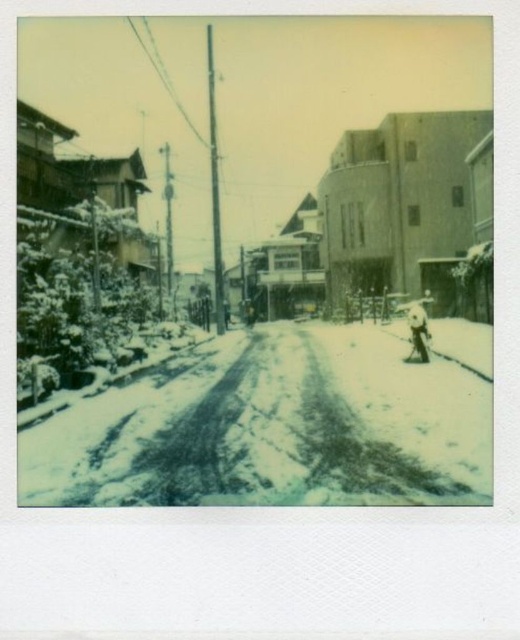
You are a delivery person trying to walk through the snowy street scene. You notice two different types of snow on the ground. Which one is deeper between the white snow at center and the white powdery snow at center?

The white snow at center is deeper than the white powdery snow at center, so the delivery person should be cautious when stepping on the white snow at center as it is taller and might be harder to walk through.

You are standing on the snowy road and want to walk towards the person on the right side. Which part of the snow should you step on first, the white snow at center or the white powdery snow at center?

You should step on the white snow at center first because it is positioned on the right side of the white powdery snow at center, which is closer to your direction towards the person on the right side.